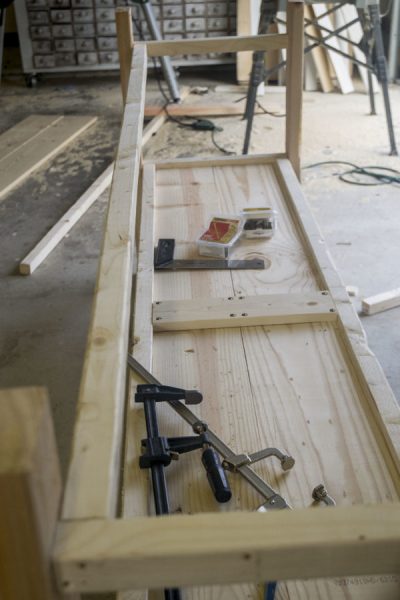
Locate an element on the screen. This screenshot has width=400, height=600. metal stand is located at coordinates (383, 82), (263, 21).